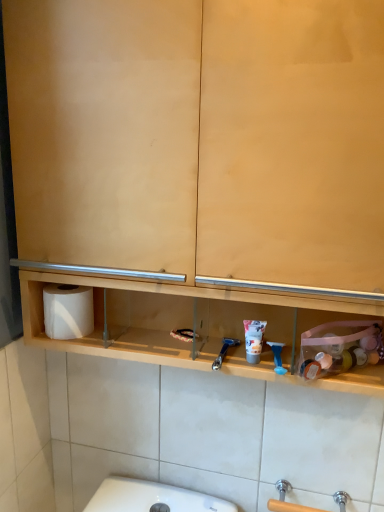
Question: Is blue plastic razor at center, which is the 2th shower in right-to-left order, facing towards white matte toilet paper at left?

Choices:
 (A) no
 (B) yes

Answer: (A)

Question: Is blue plastic razor at center, the first shower viewed from the left, touching white matte toilet paper at left?

Choices:
 (A) yes
 (B) no

Answer: (B)

Question: Considering the relative sizes of blue plastic razor at center, which is the 2th shower in right-to-left order, and white matte toilet paper at left in the image provided, is blue plastic razor at center, which is the 2th shower in right-to-left order, shorter than white matte toilet paper at left?

Choices:
 (A) yes
 (B) no

Answer: (A)

Question: Is blue plastic razor at center, the first shower viewed from the left, positioned behind white matte toilet paper at left?

Choices:
 (A) yes
 (B) no

Answer: (B)

Question: Can you confirm if blue plastic razor at center, the first shower viewed from the left, is smaller than white matte toilet paper at left?

Choices:
 (A) no
 (B) yes

Answer: (B)

Question: Would you say blue plastic razor at center, the first shower viewed from the left, is inside or outside blue plastic razor at center, marked as the first shower in a right-to-left arrangement?

Choices:
 (A) outside
 (B) inside

Answer: (A)

Question: From a real-world perspective, relative to blue plastic razor at center, marked as the first shower in a right-to-left arrangement, is blue plastic razor at center, which is the 2th shower in right-to-left order, vertically above or below?

Choices:
 (A) above
 (B) below

Answer: (B)

Question: Considering the positions of blue plastic razor at center, the first shower viewed from the left, and blue plastic razor at center, arranged as the 2th shower when viewed from the left, in the image, is blue plastic razor at center, the first shower viewed from the left, bigger or smaller than blue plastic razor at center, arranged as the 2th shower when viewed from the left,?

Choices:
 (A) small
 (B) big

Answer: (A)

Question: Based on their positions, is blue plastic razor at center, the first shower viewed from the left, located to the left or right of blue plastic razor at center, arranged as the 2th shower when viewed from the left?

Choices:
 (A) right
 (B) left

Answer: (B)

Question: In terms of height, does blue plastic razor at center, marked as the first shower in a right-to-left arrangement, look taller or shorter compared to matte plastic shaving cream at center?

Choices:
 (A) short
 (B) tall

Answer: (A)

Question: Is blue plastic razor at center, marked as the first shower in a right-to-left arrangement, in front of or behind matte plastic shaving cream at center in the image?

Choices:
 (A) behind
 (B) front

Answer: (B)

Question: Is blue plastic razor at center, marked as the first shower in a right-to-left arrangement, bigger or smaller than matte plastic shaving cream at center?

Choices:
 (A) small
 (B) big

Answer: (A)

Question: Is blue plastic razor at center, marked as the first shower in a right-to-left arrangement, spatially inside matte plastic shaving cream at center, or outside of it?

Choices:
 (A) outside
 (B) inside

Answer: (A)

Question: Choose the correct answer: Is blue plastic razor at center, arranged as the 2th shower when viewed from the left, inside blue plastic razor at center, which is the 2th shower in right-to-left order, or outside it?

Choices:
 (A) outside
 (B) inside

Answer: (A)

Question: Based on their sizes in the image, would you say blue plastic razor at center, arranged as the 2th shower when viewed from the left, is bigger or smaller than blue plastic razor at center, the first shower viewed from the left?

Choices:
 (A) small
 (B) big

Answer: (B)